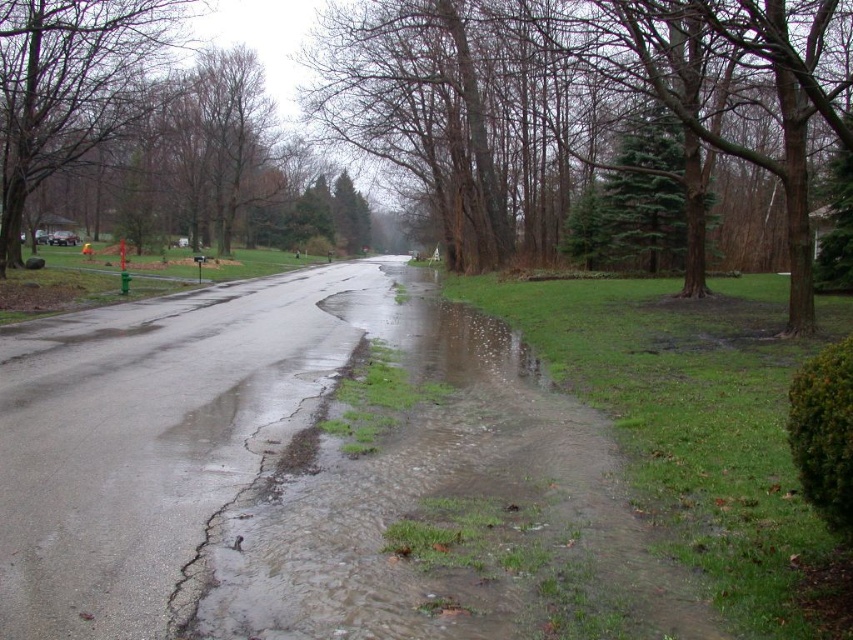
You are a delivery person standing at the edge of the road, and you need to cross to the sidewalk on the other side. The clear water at lower center is in your path. Can you step over it without getting your shoes wet?

The clear water at lower center is 4.24 meters away from you, so you can safely step over it without getting your shoes wet.

You are a delivery person trying to avoid puddles. You see the clear water at lower center and the green textured tree at center. Which object should you avoid stepping on?

You should avoid stepping on the clear water at lower center because it is located below the green textured tree at center, likely forming a puddle.